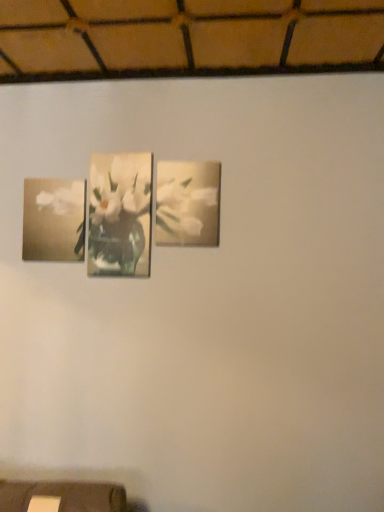
Question: Choose the correct answer: Is matte floral print at left, placed as the 2th picture frame when sorted from right to left, inside matte floral print at center, the first picture frame from the right, or outside it?

Choices:
 (A) inside
 (B) outside

Answer: (B)

Question: Considering the positions of matte floral print at left, placed as the 2th picture frame when sorted from right to left, and matte floral print at center, which is the 2th picture frame from left to right, in the image, is matte floral print at left, placed as the 2th picture frame when sorted from right to left, taller or shorter than matte floral print at center, which is the 2th picture frame from left to right,?

Choices:
 (A) tall
 (B) short

Answer: (B)

Question: Considering the real-world distances, which object is closest to the matte floral print at left, placed as the 2th picture frame when sorted from right to left?

Choices:
 (A) matte floral print at center, which is the 2th picture frame from left to right
 (B) matte floral print at center

Answer: (B)

Question: Which of these objects is positioned closest to the matte floral print at center, the first picture frame from the right?

Choices:
 (A) matte floral print at center
 (B) matte floral print at left, which is the 1th picture frame in left-to-right order

Answer: (A)